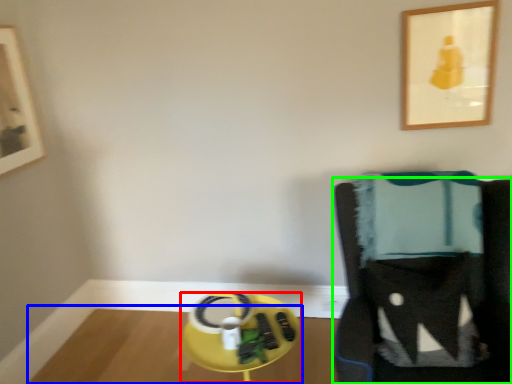
Question: Considering the real-world distances, which object is farthest from round table (highlighted by a red box)? table (highlighted by a blue box) or furniture (highlighted by a green box)?

Choices:
 (A) table
 (B) furniture

Answer: (A)